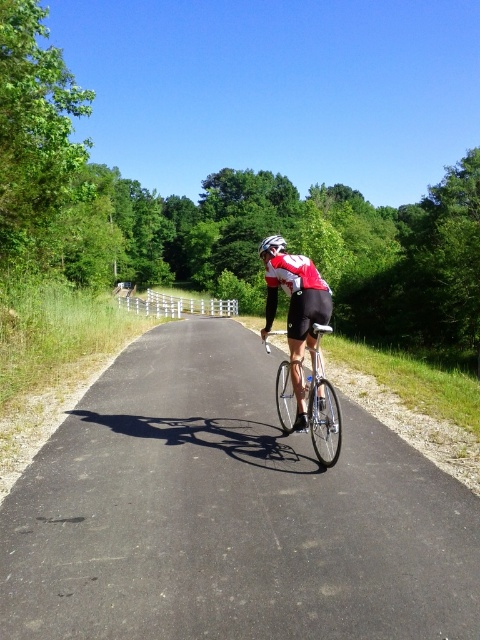
Question: Is shiny silver bicycle at center positioned in front of white matte bicycle helmet at center?

Choices:
 (A) yes
 (B) no

Answer: (A)

Question: Which point is closer to the camera?

Choices:
 (A) white matte bicycle helmet at center
 (B) shiny silver bicycle at center

Answer: (B)

Question: Is shiny silver bicycle at center further to camera compared to silver metallic bicycle at center?

Choices:
 (A) no
 (B) yes

Answer: (A)

Question: Which point is closer to the camera?

Choices:
 (A) shiny silver bicycle at center
 (B) white matte bicycle helmet at center
 (C) silver metallic bicycle at center

Answer: (A)

Question: Which of the following is the closest to the observer?

Choices:
 (A) (319, 419)
 (B) (276, 236)
 (C) (325, 420)

Answer: (C)

Question: Can you confirm if silver metallic bicycle at center is bigger than white matte bicycle helmet at center?

Choices:
 (A) yes
 (B) no

Answer: (B)